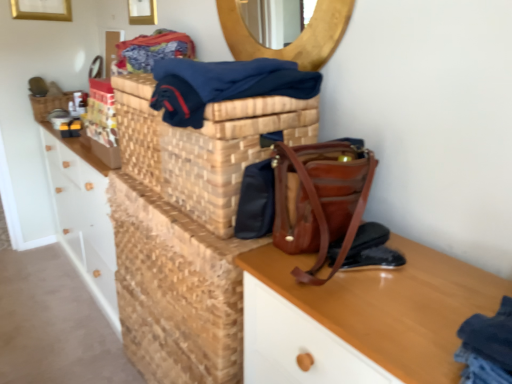
Measure the distance between point (347, 186) and camera.

Point (347, 186) and camera are 1.00 meters apart from each other.

What do you see at coordinates (153, 50) in the screenshot?
I see `textured fabric clothing at upper center` at bounding box center [153, 50].

What do you see at coordinates (368, 238) in the screenshot? This screenshot has width=512, height=384. I see `leather at center, acting as the 2th shoe starting from the bottom` at bounding box center [368, 238].

Locate an element on the screen. gold metallic picture frame at upper left, which ranks as the second picture frame in front-to-back order is located at coordinates (42, 10).

How many degrees apart are the facing directions of wooden picture frame at upper center, which is the second picture frame in left-to-right order, and wooden mirror at upper center?

The angular difference between wooden picture frame at upper center, which is the second picture frame in left-to-right order, and wooden mirror at upper center is 0.892 degrees.

Is wooden picture frame at upper center, the 2th picture frame positioned from the back, positioned far away from wooden mirror at upper center?

That's not correct — wooden picture frame at upper center, the 2th picture frame positioned from the back, is a little close to wooden mirror at upper center.

From the image's perspective, which one is positioned higher, wooden picture frame at upper center, which is the second picture frame in left-to-right order, or wooden mirror at upper center?

wooden picture frame at upper center, which is the second picture frame in left-to-right order, is shown above in the image.

From a real-world perspective, is wooden picture frame at upper center, which is the second picture frame in left-to-right order, on wooden mirror at upper center?

Yes.

From their relative heights in the image, would you say black leather shoe at lower right, positioned as the 1th shoe in bottom-to-top order, is taller or shorter than brown leather handbag at center?

black leather shoe at lower right, positioned as the 1th shoe in bottom-to-top order, is shorter than brown leather handbag at center.

Considering the positions of objects black leather shoe at lower right, positioned as the 1th shoe in bottom-to-top order, and brown leather handbag at center in the image provided, who is more to the right, black leather shoe at lower right, positioned as the 1th shoe in bottom-to-top order, or brown leather handbag at center?

From the viewer's perspective, black leather shoe at lower right, positioned as the 1th shoe in bottom-to-top order, appears more on the right side.

In the scene shown: Which is more distant, (346, 269) or (287, 250)?

The point (287, 250) is farther from the camera.

Which of these two, black leather shoe at lower right, positioned as the 1th shoe in bottom-to-top order, or brown leather handbag at center, is thinner?

black leather shoe at lower right, positioned as the 1th shoe in bottom-to-top order.

Is wooden mirror at upper center wider or thinner than wooden woven basket at upper left?

wooden mirror at upper center is thinner than wooden woven basket at upper left.

Are wooden mirror at upper center and wooden woven basket at upper left far apart?

wooden mirror at upper center is positioned a significant distance from wooden woven basket at upper left.

Considering the positions of points (236, 0) and (47, 109), is point (236, 0) closer to camera compared to point (47, 109)?

Yes, point (236, 0) is closer to viewer.

Is wooden mirror at upper center behind wooden desk at lower right?

Yes, wooden mirror at upper center is further from the camera.

Locate an element on the screen. The width and height of the screenshot is (512, 384). desk below the wooden mirror at upper center (from a real-world perspective) is located at coordinates (362, 317).

Would you consider wooden mirror at upper center to be distant from wooden desk at lower right?

No, wooden mirror at upper center is not far from wooden desk at lower right.

Considering the relative sizes of wooden mirror at upper center and wooden desk at lower right in the image provided, is wooden mirror at upper center wider than wooden desk at lower right?

Incorrect, the width of wooden mirror at upper center does not surpass that of wooden desk at lower right.

Measure the distance between wooden desk at lower right and black leather shoe at lower right, positioned as the 1th shoe in bottom-to-top order.

The distance of wooden desk at lower right from black leather shoe at lower right, positioned as the 1th shoe in bottom-to-top order, is 6.58 inches.

Would you say wooden desk at lower right is inside or outside black leather shoe at lower right, the 2th shoe viewed from the top?

wooden desk at lower right exists outside the volume of black leather shoe at lower right, the 2th shoe viewed from the top.

Which is nearer, (x=252, y=269) or (x=380, y=262)?

The point (x=252, y=269) is closer.

Which object is wider, wooden desk at lower right or black leather shoe at lower right, the 2th shoe viewed from the top?

wooden desk at lower right is wider.

Would you say brown leather handbag at center is outside dark blue fabric at upper center?

That's correct, brown leather handbag at center is outside of dark blue fabric at upper center.

Are brown leather handbag at center and dark blue fabric at upper center making contact?

brown leather handbag at center and dark blue fabric at upper center are clearly separated.

Which is closer, (x=347, y=216) or (x=173, y=79)?

The point (x=347, y=216) is closer to the camera.

Is brown leather handbag at center oriented away from dark blue fabric at upper center?

brown leather handbag at center does not have its back to dark blue fabric at upper center.

Is textured fabric clothing at upper center not near dark blue fabric at upper center?

No, textured fabric clothing at upper center is not far from dark blue fabric at upper center.

Which object is wider, textured fabric clothing at upper center or dark blue fabric at upper center?

With larger width is dark blue fabric at upper center.

Considering the sizes of objects textured fabric clothing at upper center and dark blue fabric at upper center in the image provided, who is shorter, textured fabric clothing at upper center or dark blue fabric at upper center?

Standing shorter between the two is textured fabric clothing at upper center.

Starting from the wooden mirror at upper center, which picture frame is the 1st one behind? Please provide its 2D coordinates.

[(142, 12)]

Identify the location of the 2nd shoe positioned below the brown leather handbag at center (from a real-world perspective). (374, 259).

Considering their positions, is woven brown basket at center positioned closer to leather at center, the 1th shoe in the top-to-bottom sequence, than wooden mirror at upper center?

Among the two, woven brown basket at center is located nearer to leather at center, the 1th shoe in the top-to-bottom sequence.

Estimate the real-world distances between objects in this image. Which object is further from wooden woven basket at upper left, woven brown basket at center or leather at center, acting as the 2th shoe starting from the bottom?

leather at center, acting as the 2th shoe starting from the bottom, is further to wooden woven basket at upper left.

Based on their spatial positions, is woven brown basket at center or dark blue fabric at upper center further from wooden woven basket at upper left?

The object further to wooden woven basket at upper left is dark blue fabric at upper center.

Looking at the image, which one is located closer to textured fabric clothing at upper center, wooden woven basket at upper left or gold metallic picture frame at upper left, which ranks as the second picture frame in front-to-back order?

Among the two, wooden woven basket at upper left is located nearer to textured fabric clothing at upper center.

Which object lies further to the anchor point black leather shoe at lower right, the 2th shoe viewed from the top, leather at center, the 1th shoe in the top-to-bottom sequence, or wooden mirror at upper center?

The object further to black leather shoe at lower right, the 2th shoe viewed from the top, is wooden mirror at upper center.

Based on their spatial positions, is black leather shoe at lower right, positioned as the 1th shoe in bottom-to-top order, or wooden mirror at upper center further from leather at center, the 1th shoe in the top-to-bottom sequence?

wooden mirror at upper center is positioned further to the anchor leather at center, the 1th shoe in the top-to-bottom sequence.

Considering their positions, is wooden desk at lower right positioned further to woven brown basket at center than wooden mirror at upper center?

Based on the image, wooden desk at lower right appears to be further to woven brown basket at center.

Based on their spatial positions, is leather at center, acting as the 2th shoe starting from the bottom, or wooden woven basket at upper left further from wooden desk at lower right?

The object further to wooden desk at lower right is wooden woven basket at upper left.

Find the location of a particular element. The width and height of the screenshot is (512, 384). mirror positioned between dark blue fabric at upper center and textured fabric clothing at upper center from near to far is located at coordinates (295, 40).

Find the location of a particular element. The height and width of the screenshot is (384, 512). basket container located between dark blue fabric at upper center and textured fabric clothing at upper center in the depth direction is located at coordinates (204, 147).

Locate an element on the screen. The width and height of the screenshot is (512, 384). mirror that lies between wooden picture frame at upper center, which appears as the first picture frame when viewed from the front, and leather at center, the 1th shoe in the top-to-bottom sequence, from top to bottom is located at coordinates (295, 40).

Locate an element on the screen. basket container between dark blue fabric at upper center and leather at center, the 1th shoe in the top-to-bottom sequence, from top to bottom is located at coordinates (204, 147).